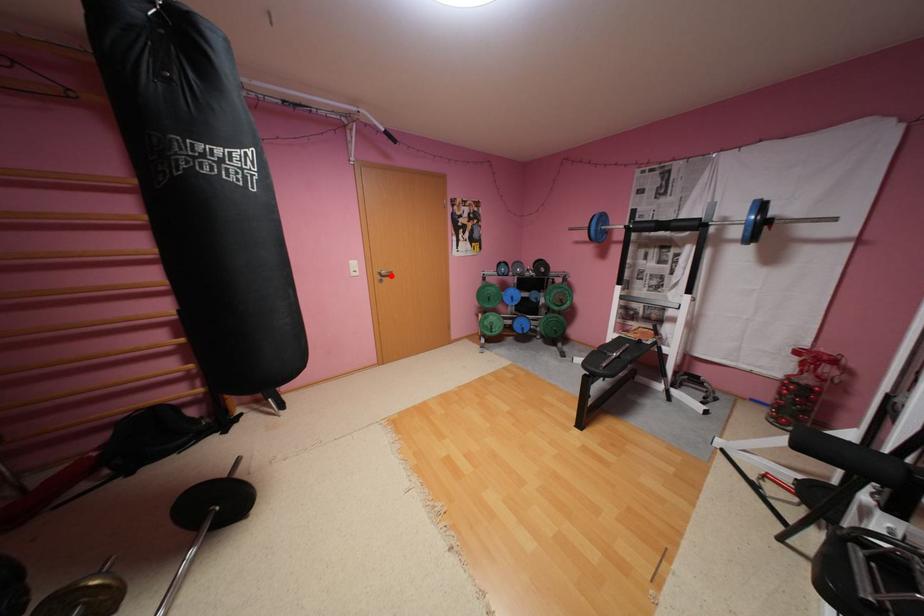
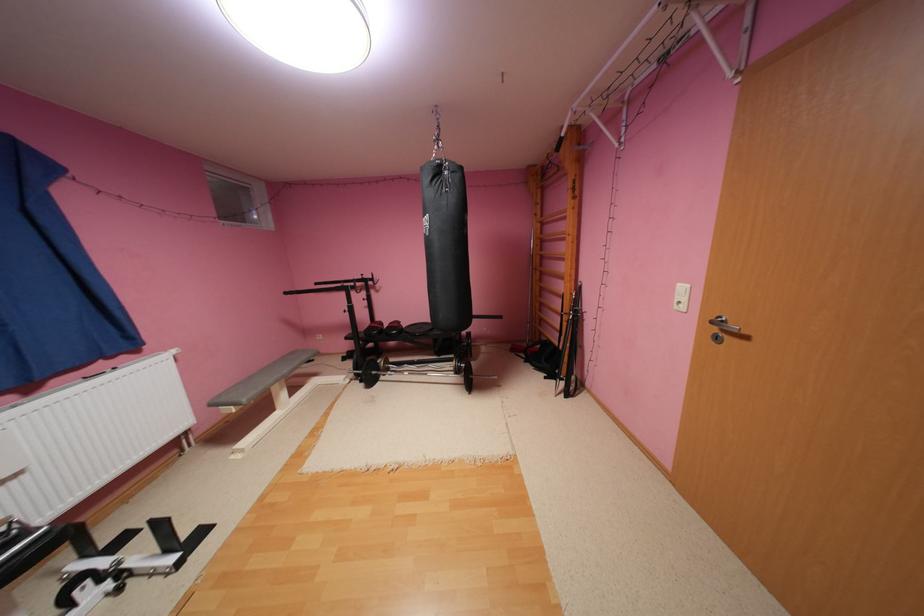
In the second image, find the point that corresponds to the highlighted location in the first image.

(733, 330)